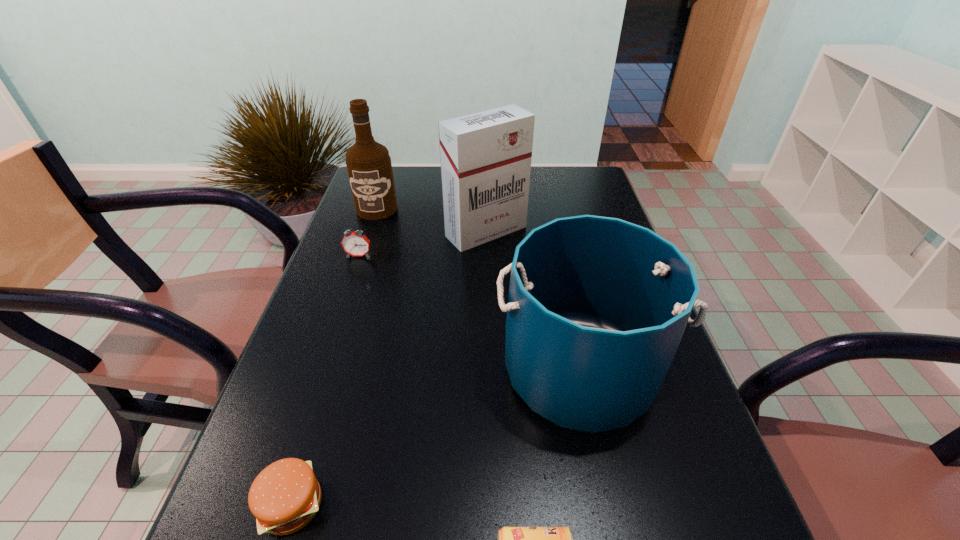
The height and width of the screenshot is (540, 960). Find the location of `cigarette case`. cigarette case is located at coordinates (485, 157).

The height and width of the screenshot is (540, 960). Find the location of `alcohol`. alcohol is located at coordinates (369, 167).

Find the location of a particular element. The width and height of the screenshot is (960, 540). bucket is located at coordinates (597, 306).

I want to click on the third tallest object, so click(x=597, y=306).

This screenshot has height=540, width=960. Identify the location of the fourth tallest object. (354, 243).

I want to click on vacant space located 0.250m on the back of the cigarette case, so click(x=485, y=174).

Locate an element on the screen. The width and height of the screenshot is (960, 540). vacant area located on the label of the alcohol is located at coordinates (354, 277).

The width and height of the screenshot is (960, 540). I want to click on free space located 0.400m on the back of the fourth farthest object, so click(549, 220).

Find the location of a particular element. vacant region located on the clock face of the alarm clock is located at coordinates (324, 356).

What are the coordinates of `object located in the far edge section of the desktop` in the screenshot? It's located at (369, 167).